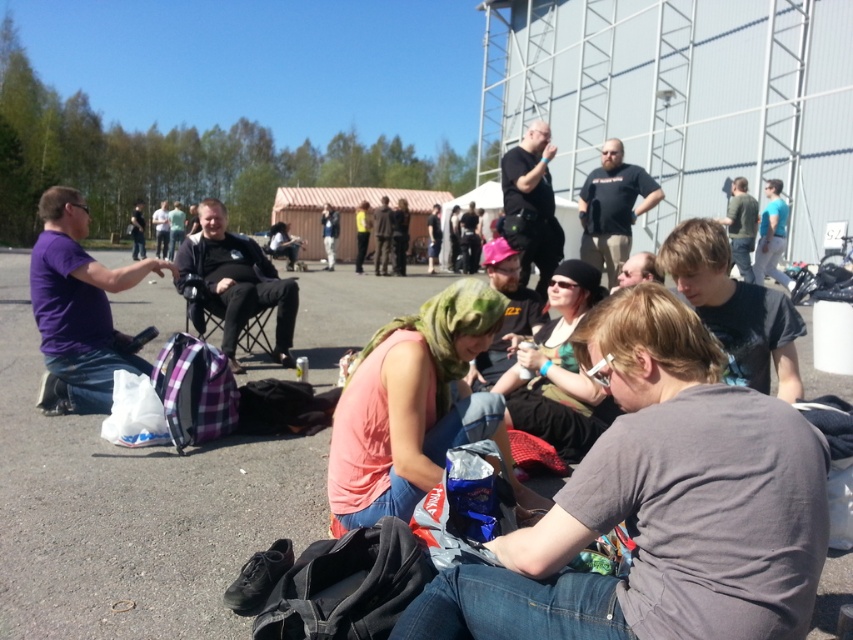
At what (x,y) coordinates should I click in order to perform the action: click on purple matte shirt at left. Please return your answer as a coordinate pair (x, y). Looking at the image, I should click on (78, 308).

Who is lower down, purple matte shirt at left or blue t-shirt at upper right?

Positioned lower is purple matte shirt at left.

Measure the distance between purple matte shirt at left and camera.

A distance of 14.09 feet exists between purple matte shirt at left and camera.

You are a GUI agent. You are given a task and a screenshot of the screen. Output one action in this format:
    pyautogui.click(x=<x>, y=<y>)
    Task: Click on the purple matte shirt at left
    This screenshot has height=640, width=853.
    Given the screenshot: What is the action you would take?
    78,308

Can you confirm if black fabric chair at center is positioned to the right of green fabric shirt at upper right?

In fact, black fabric chair at center is to the left of green fabric shirt at upper right.

This screenshot has height=640, width=853. I want to click on black fabric chair at center, so click(x=236, y=282).

Identify the location of black fabric chair at center. The image size is (853, 640). (236, 282).

How far apart are black matte shirt at center and blue t-shirt at upper right?

A distance of 5.77 meters exists between black matte shirt at center and blue t-shirt at upper right.

Which of these two, black matte shirt at center or blue t-shirt at upper right, stands shorter?

With less height is black matte shirt at center.

Image resolution: width=853 pixels, height=640 pixels. Find the location of `black matte shirt at center`. black matte shirt at center is located at coordinates (612, 209).